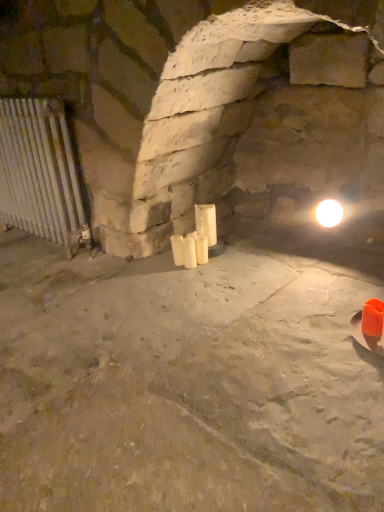
Question: Is silver metallic radiator at left closer to the viewer compared to white matte candle at center, the first candle positioned from the left?

Choices:
 (A) no
 (B) yes

Answer: (B)

Question: Is silver metallic radiator at left to the left of white matte candle at center, which ranks as the 3th candle in right-to-left order, from the viewer's perspective?

Choices:
 (A) yes
 (B) no

Answer: (A)

Question: Can you confirm if silver metallic radiator at left is smaller than white matte candle at center, the first candle positioned from the left?

Choices:
 (A) yes
 (B) no

Answer: (B)

Question: Is silver metallic radiator at left taller than white matte candle at center, the first candle positioned from the left?

Choices:
 (A) no
 (B) yes

Answer: (B)

Question: From the image's perspective, is silver metallic radiator at left below white matte candle at center, the first candle positioned from the left?

Choices:
 (A) no
 (B) yes

Answer: (A)

Question: In the image, is silver metallic radiator at left on the left side or the right side of white matte candle at center, which ranks as the first candle in right-to-left order?

Choices:
 (A) left
 (B) right

Answer: (A)

Question: Is silver metallic radiator at left wider or thinner than white matte candle at center, which ranks as the first candle in right-to-left order?

Choices:
 (A) wide
 (B) thin

Answer: (A)

Question: From a real-world perspective, is silver metallic radiator at left above or below white matte candle at center, which is counted as the 3th candle, starting from the left?

Choices:
 (A) above
 (B) below

Answer: (A)

Question: In terms of size, does silver metallic radiator at left appear bigger or smaller than white matte candle at center, which is counted as the 3th candle, starting from the left?

Choices:
 (A) big
 (B) small

Answer: (A)

Question: From the image's perspective, is silver metallic radiator at left positioned above or below white matte candle at center, the first candle positioned from the left?

Choices:
 (A) above
 (B) below

Answer: (A)

Question: In the image, is silver metallic radiator at left positioned in front of or behind white matte candle at center, the first candle positioned from the left?

Choices:
 (A) front
 (B) behind

Answer: (A)

Question: In terms of height, does silver metallic radiator at left look taller or shorter compared to white matte candle at center, which ranks as the 3th candle in right-to-left order?

Choices:
 (A) tall
 (B) short

Answer: (A)

Question: Do you think silver metallic radiator at left is within white matte candle at center, which ranks as the 3th candle in right-to-left order, or outside of it?

Choices:
 (A) outside
 (B) inside

Answer: (A)

Question: From the image's perspective, is white matte candle at center, the second candle positioned from the left, positioned above or below white matte candle at center, which ranks as the 3th candle in right-to-left order?

Choices:
 (A) below
 (B) above

Answer: (A)

Question: Considering their positions, is white matte candle at center, the second candle positioned from the left, located in front of or behind white matte candle at center, the first candle positioned from the left?

Choices:
 (A) front
 (B) behind

Answer: (A)